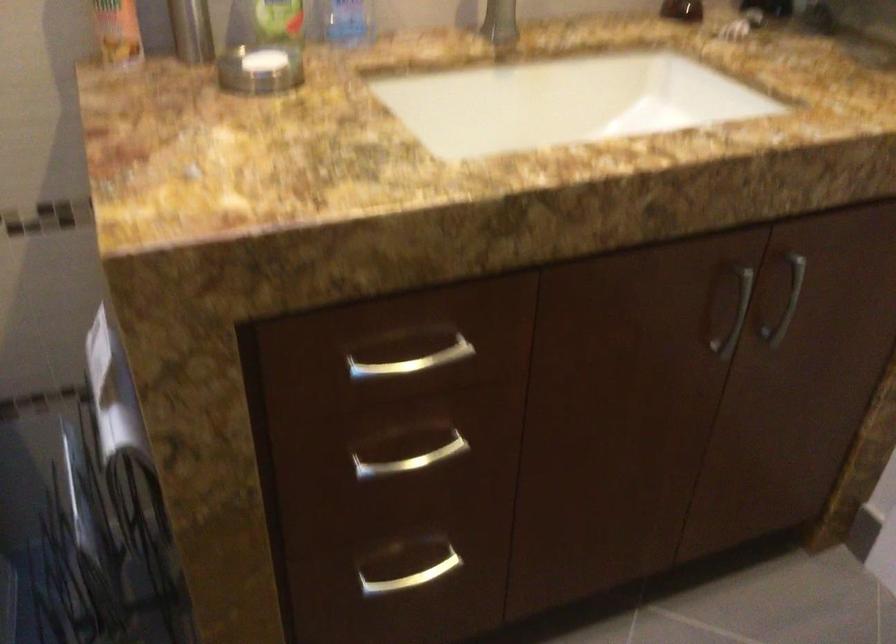
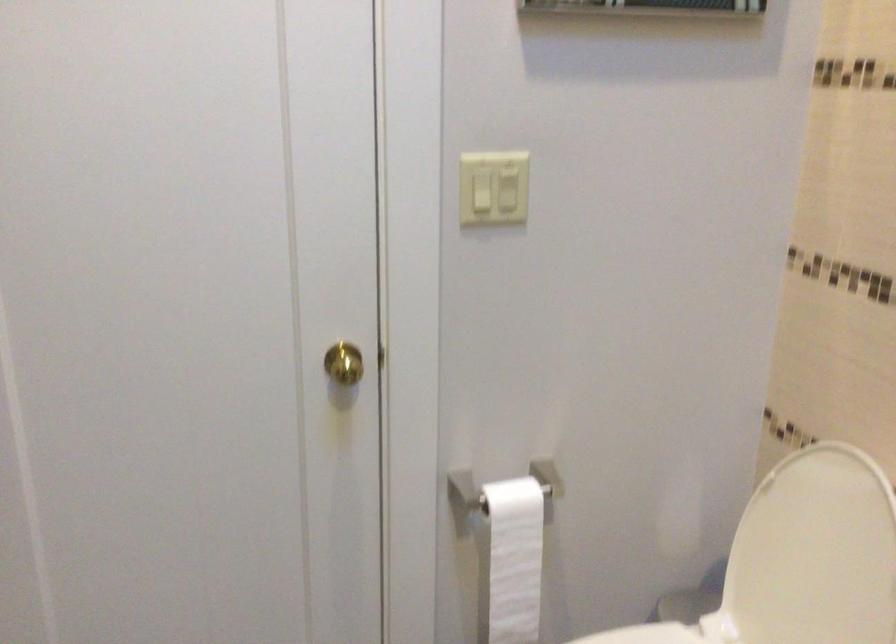
The images are taken continuously from a first-person perspective. In which direction is your viewpoint rotating?

The rotation direction of the camera is left-down.